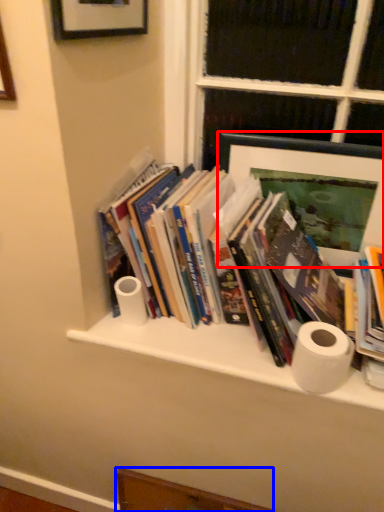
Question: Which of the following is the farthest to the observer, picture frame (highlighted by a red box) or drawer (highlighted by a blue box)?

Choices:
 (A) picture frame
 (B) drawer

Answer: (B)